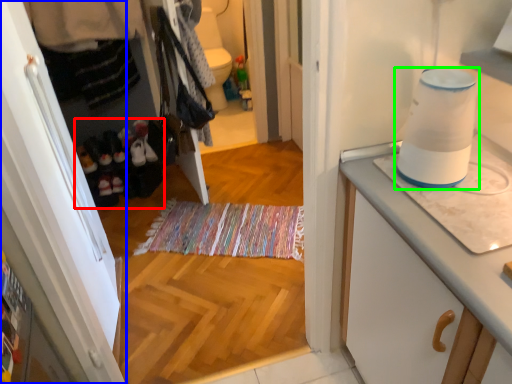
Question: Which object is the farthest from footwear (highlighted by a red box)? Choose among these: cabinetry (highlighted by a blue box) or home appliance (highlighted by a green box).

Choices:
 (A) cabinetry
 (B) home appliance

Answer: (B)